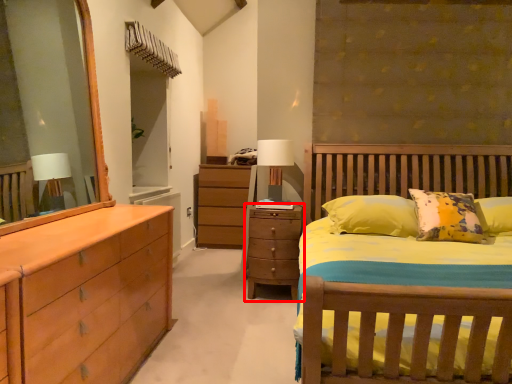
Question: Considering the relative positions of chest of drawers (annotated by the red box) and table lamp in the image provided, where is chest of drawers (annotated by the red box) located with respect to the staircase?

Choices:
 (A) right
 (B) left

Answer: (A)